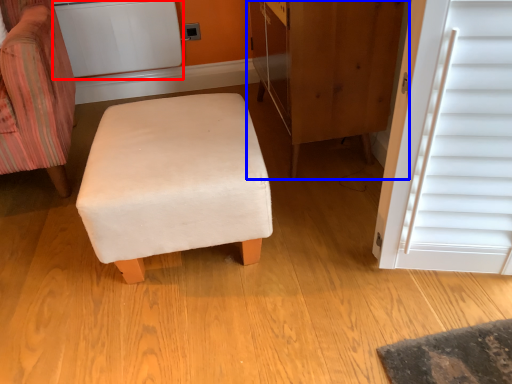
Question: Among these objects, which one is farthest to the camera, appliance (highlighted by a red box) or dresser (highlighted by a blue box)?

Choices:
 (A) appliance
 (B) dresser

Answer: (A)